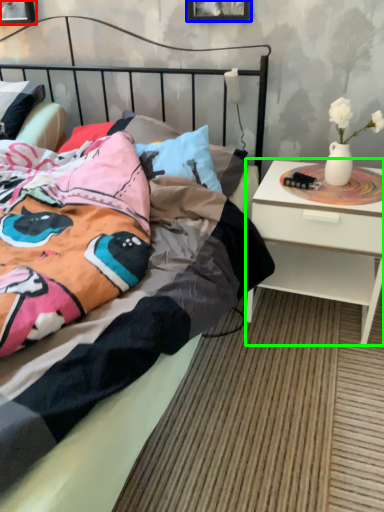
Question: Considering the real-world distances, which object is farthest from picture frame (highlighted by a red box)? picture frame (highlighted by a blue box) or nightstand (highlighted by a green box)?

Choices:
 (A) picture frame
 (B) nightstand

Answer: (B)